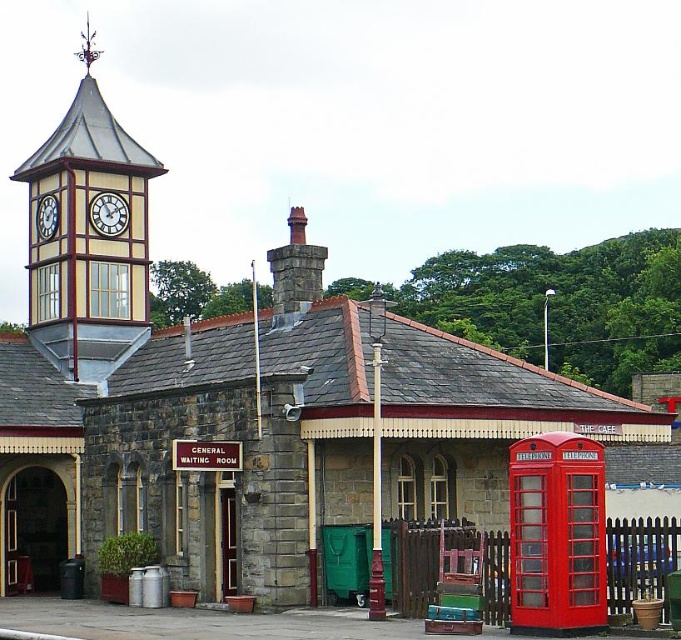
Question: Which point is closer to the camera taking this photo?

Choices:
 (A) (52, 212)
 (B) (110, 236)
 (C) (136, 301)

Answer: (B)

Question: Does metallic clock face at upper left have a greater width compared to white clock face at upper left?

Choices:
 (A) yes
 (B) no

Answer: (A)

Question: Which point is closer to the camera?

Choices:
 (A) white clock face at upper left
 (B) wooden clock tower at upper left
 (C) metallic clock face at upper left

Answer: (B)

Question: In this image, where is metallic clock face at upper left located relative to white clock face at upper left?

Choices:
 (A) right
 (B) left

Answer: (A)

Question: Which of the following is the farthest from the observer?

Choices:
 (A) (97, 195)
 (B) (52, 196)
 (C) (123, 330)

Answer: (B)

Question: Does wooden clock tower at upper left appear over metallic clock face at upper left?

Choices:
 (A) no
 (B) yes

Answer: (B)